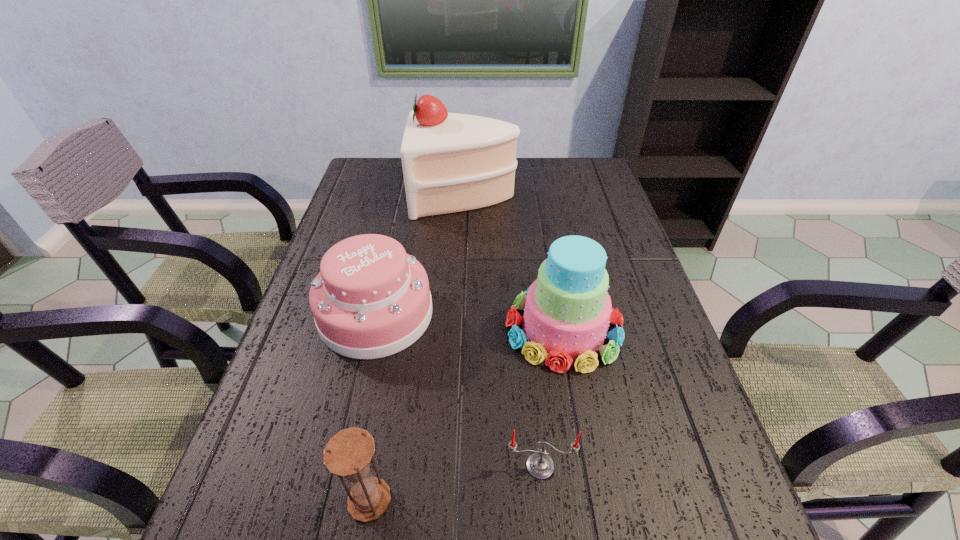
The image size is (960, 540). Identify the location of the tallest object. (452, 162).

This screenshot has height=540, width=960. In order to click on the farthest object in this screenshot , I will do `click(452, 162)`.

Where is `the second tallest object`? the second tallest object is located at coordinates (567, 310).

Identify the location of hourglass. The height and width of the screenshot is (540, 960). (348, 454).

Find the location of a particular element. The height and width of the screenshot is (540, 960). the shortest cake is located at coordinates (370, 300).

Where is `the shortest object`? the shortest object is located at coordinates (540, 465).

The height and width of the screenshot is (540, 960). I want to click on blank area located 0.160m on the front of the farthest object, so click(462, 255).

Locate an element on the screen. This screenshot has width=960, height=540. free space located on the back of the second tallest cake is located at coordinates (541, 207).

I want to click on free space located 0.210m on the left of the hourglass, so [225, 500].

Locate an element on the screen. free region located on the back of the shortest cake is located at coordinates (390, 254).